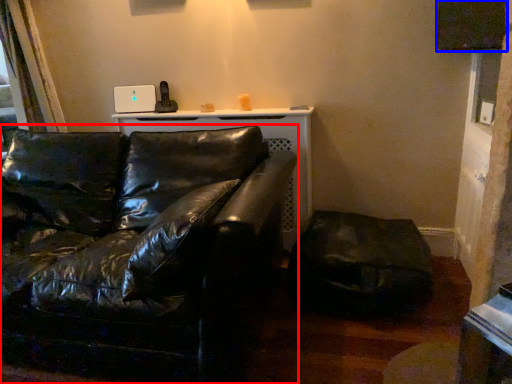
Question: Among these objects, which one is nearest to the camera, studio couch (highlighted by a red box) or window screen (highlighted by a blue box)?

Choices:
 (A) studio couch
 (B) window screen

Answer: (A)